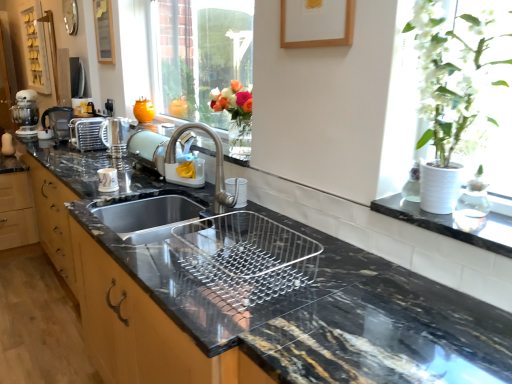
Find the location of `blank space above black marble sink at center (from a real-world perspective)`. blank space above black marble sink at center (from a real-world perspective) is located at coordinates (241, 255).